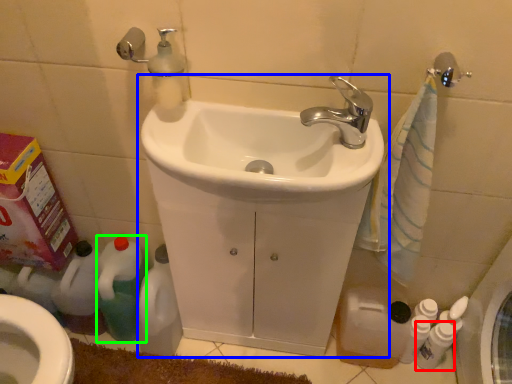
Question: Which object is positioned closest to cleaning product (highlighted by a red box)? Select from sink (highlighted by a blue box) and cleaning product (highlighted by a green box).

Choices:
 (A) sink
 (B) cleaning product

Answer: (A)